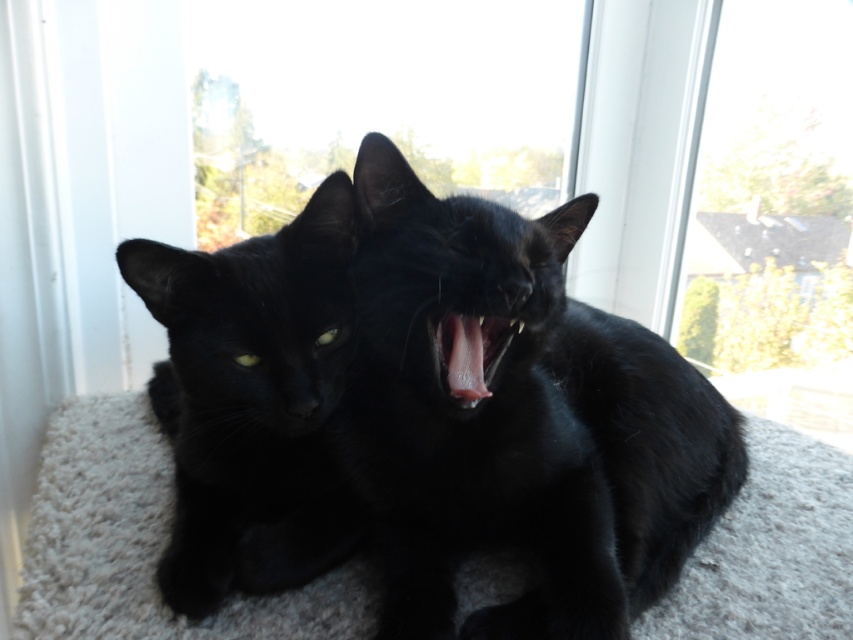
You are a photographer setting up a shoot. You want to place a small prop between the black silky cat at center and the white carpet at lower center. Based on their positions, where should you place the prop to ensure it is between them?

The black silky cat at center is positioned on the right side of white carpet at lower center, so you should place the prop to the left of the black silky cat at center and to the right of the white carpet at lower center to ensure it is between them.

You need to place a small toy between the black silky cat at center and the white carpet at lower center. Based on their sizes, which one has more room around it for the toy?

The white carpet at lower center has more room around it than the black silky cat at center because the black silky cat at center occupies less space.

You are standing in front of the two black cats sitting on the light surface. There are two points marked in the image. Which point, point (637, 609) or point (86, 518), is closer to you?

Point (637, 609) is closer to the viewer than point (86, 518).